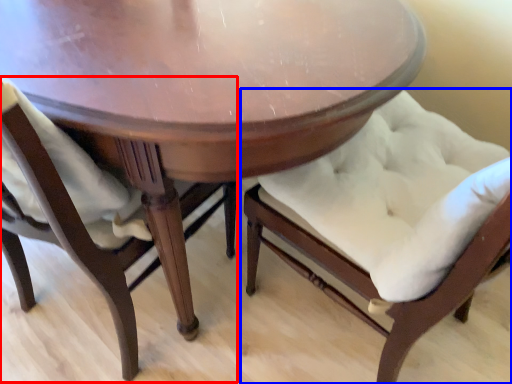
Question: Among these objects, which one is farthest to the camera, chair (highlighted by a red box) or chair (highlighted by a blue box)?

Choices:
 (A) chair
 (B) chair

Answer: (A)